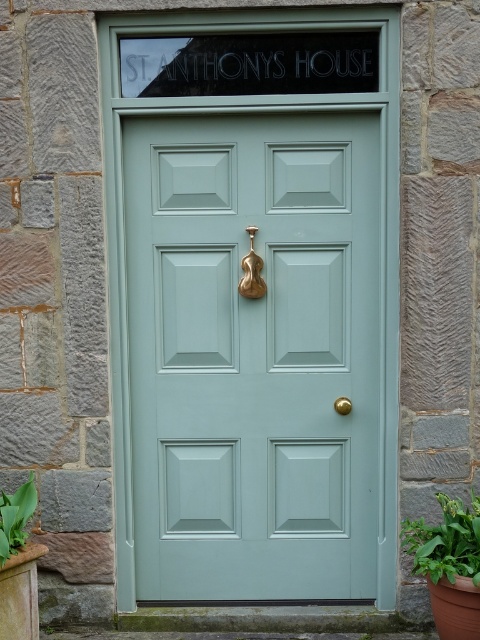
You are standing in front of the front door and want to touch both the point at coordinates point (x=7, y=529) and point (x=350, y=410). Which point should you reach for first?

You should reach for point (x=7, y=529) first because it is closer to you than point (x=350, y=410).